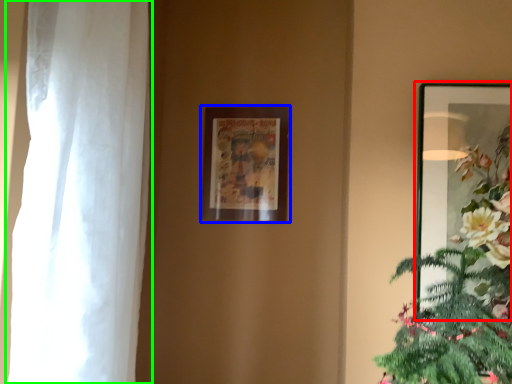
Question: Considering the real-world distances, which object is farthest from picture frame (highlighted by a red box)? picture frame (highlighted by a blue box) or curtain (highlighted by a green box)?

Choices:
 (A) picture frame
 (B) curtain

Answer: (B)